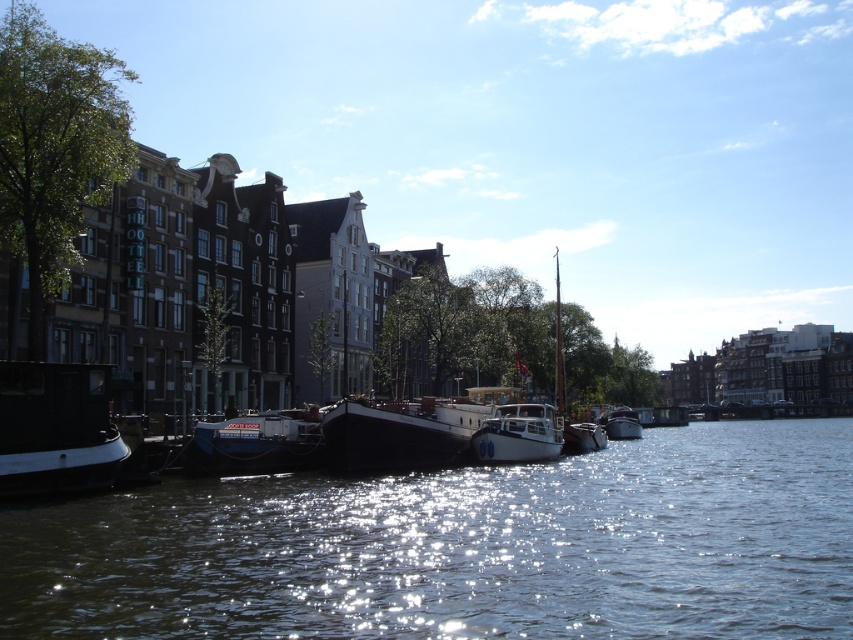
In the scene shown: Does shiny black boat at lower left come behind black matte boat at center?

That is False.

Image resolution: width=853 pixels, height=640 pixels. I want to click on shiny black boat at lower left, so click(x=56, y=428).

Identify the location of shiny black boat at lower left. (56, 428).

Can you confirm if shiny dark water at lower center is bigger than white glossy boat at center?

Correct, shiny dark water at lower center is larger in size than white glossy boat at center.

Locate an element on the screen. This screenshot has width=853, height=640. shiny dark water at lower center is located at coordinates (463, 547).

This screenshot has height=640, width=853. I want to click on shiny dark water at lower center, so click(463, 547).

Is blue matte boat at center to the left of white glossy boat at center from the viewer's perspective?

Yes, blue matte boat at center is to the left of white glossy boat at center.

Is blue matte boat at center below white glossy boat at center?

Actually, blue matte boat at center is above white glossy boat at center.

Identify the location of blue matte boat at center. The image size is (853, 640). (254, 445).